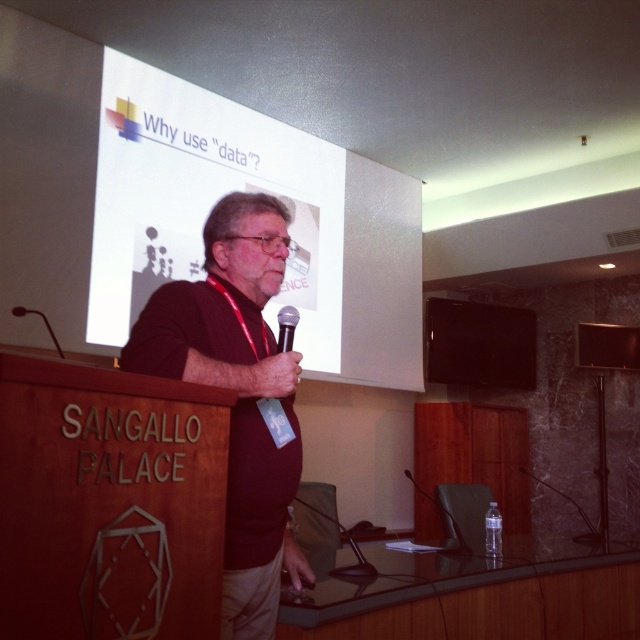
The width and height of the screenshot is (640, 640). Describe the element at coordinates (253, 189) in the screenshot. I see `white matte projection screen at upper center` at that location.

Is white matte projection screen at upper center bigger than dark red shirt at center?

Yes, white matte projection screen at upper center is bigger than dark red shirt at center.

Is point (115, 144) farther from viewer compared to point (232, 301)?

Yes, it is behind point (232, 301).

Locate an element on the screen. The width and height of the screenshot is (640, 640). white matte projection screen at upper center is located at coordinates (253, 189).

Image resolution: width=640 pixels, height=640 pixels. In order to click on dark red shirt at center in this screenshot , I will do `click(237, 394)`.

Is dark red shirt at center below black matte microphone at left?

Yes, dark red shirt at center is below black matte microphone at left.

Who is more forward, (218, 230) or (51, 337)?

Positioned in front is point (218, 230).

You are a GUI agent. You are given a task and a screenshot of the screen. Output one action in this format:
    pyautogui.click(x=<x>, y=<y>)
    Task: Click on the dark red shirt at center
    This screenshot has height=640, width=640.
    Given the screenshot: What is the action you would take?
    pyautogui.click(x=237, y=394)

Can you confirm if white matte projection screen at upper center is wider than black matte microphone at center?

Correct, the width of white matte projection screen at upper center exceeds that of black matte microphone at center.

Does white matte projection screen at upper center have a greater height compared to black matte microphone at center?

Yes, white matte projection screen at upper center is taller than black matte microphone at center.

Who is more forward, (104, 52) or (280, 333)?

Positioned in front is point (280, 333).

This screenshot has width=640, height=640. I want to click on white matte projection screen at upper center, so click(x=253, y=189).